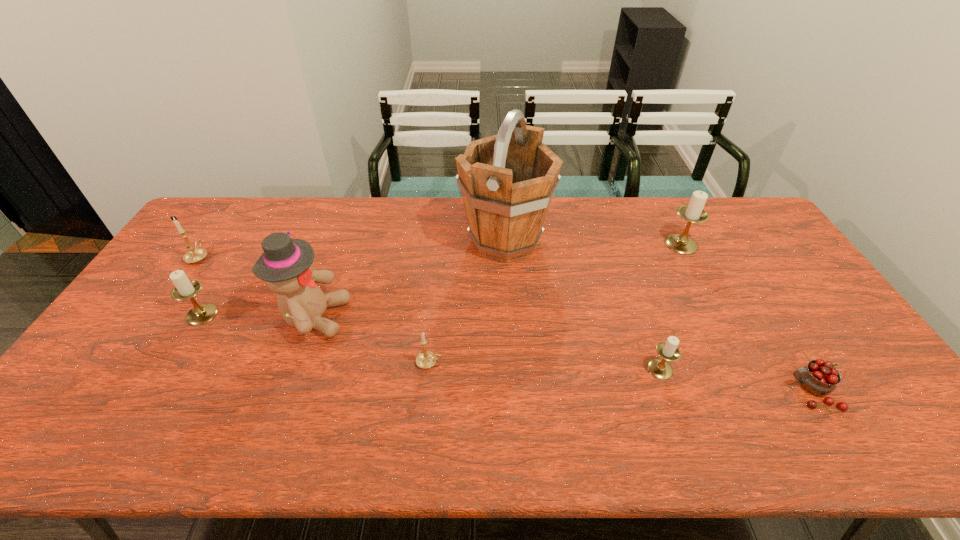
Identify the location of free point located 0.120m on the handle side of the leftmost candle holder. The image size is (960, 540). 220,226.

Find the location of a particular element. The height and width of the screenshot is (540, 960). blank space located 0.290m on the handle side of the leftmost candle holder is located at coordinates (239, 198).

I want to click on vacant space located on the right of the second candle holder from left to right, so click(350, 314).

Where is `free space located on the handle side of the smaller gold candle holder`? The width and height of the screenshot is (960, 540). free space located on the handle side of the smaller gold candle holder is located at coordinates (473, 362).

This screenshot has width=960, height=540. I want to click on free space located on the front of the nearest white candle holder, so click(x=688, y=450).

Find the location of a particular element. Image resolution: width=960 pixels, height=540 pixels. free space located on the handle side of the rightmost object is located at coordinates (646, 392).

Locate an element on the screen. This screenshot has height=540, width=960. vacant space situated 0.370m on the handle side of the rightmost object is located at coordinates (638, 392).

Find the location of a particular element. This screenshot has height=540, width=960. vacant space located on the handle side of the rightmost object is located at coordinates (711, 392).

This screenshot has height=540, width=960. Identify the location of bucket located at the far edge. (507, 180).

You are a GUI agent. You are given a task and a screenshot of the screen. Output one action in this format:
    pyautogui.click(x=<x>, y=<y>)
    Task: Click on the candle holder at the far edge
    
    Given the screenshot: What is the action you would take?
    pyautogui.click(x=693, y=213)